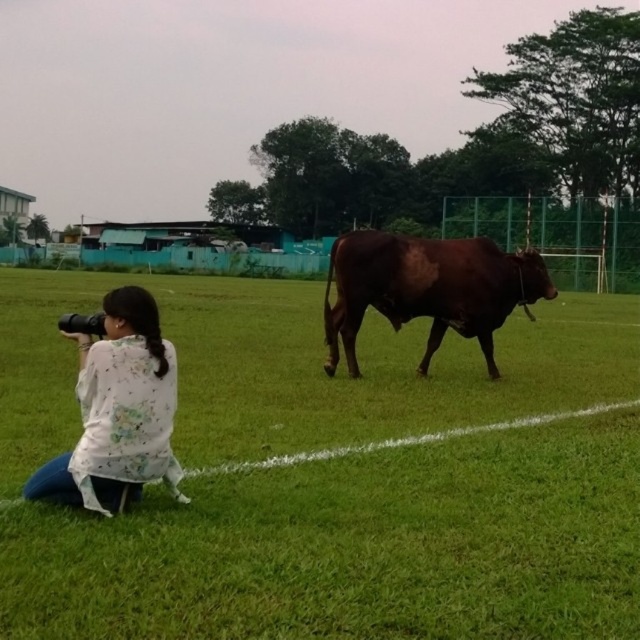
Question: Which point appears closest to the camera in this image?

Choices:
 (A) (289, 625)
 (B) (422, 260)

Answer: (A)

Question: Observing the image, what is the correct spatial positioning of green grass at lower center in reference to brown matte bull at center?

Choices:
 (A) left
 (B) right

Answer: (A)

Question: Is white floral shirt at lower left below brown matte bull at center?

Choices:
 (A) yes
 (B) no

Answer: (A)

Question: Among these objects, which one is farthest from the camera?

Choices:
 (A) green grass at lower center
 (B) brown matte bull at center
 (C) white floral shirt at lower left

Answer: (B)

Question: Which object is positioned farthest from the white floral shirt at lower left?

Choices:
 (A) brown matte bull at center
 (B) green grass at lower center

Answer: (B)

Question: Is green grass at lower center closer to camera compared to white floral shirt at lower left?

Choices:
 (A) yes
 (B) no

Answer: (A)